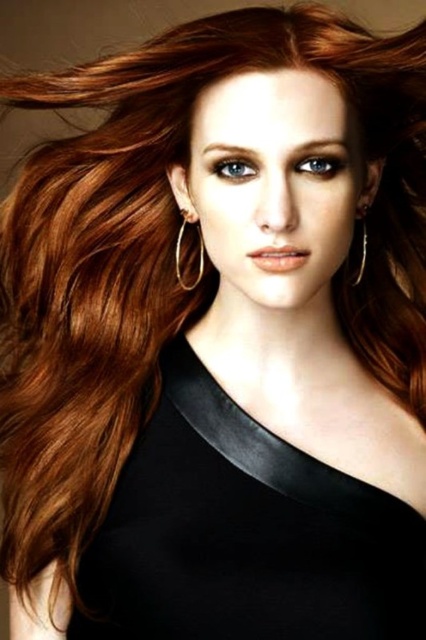
Question: Which object is closer to the camera taking this photo?

Choices:
 (A) black satin dress at center
 (B) silver metallic hoop at center
 (C) gold metallic hoop at upper left

Answer: (A)

Question: Does silver metallic hoop at center have a smaller size compared to gold metallic hoop at upper left?

Choices:
 (A) no
 (B) yes

Answer: (A)

Question: Does silver metallic hoop at center appear over gold metallic hoop at upper left?

Choices:
 (A) yes
 (B) no

Answer: (A)

Question: Estimate the real-world distances between objects in this image. Which object is farther from the black satin dress at center?

Choices:
 (A) silver metallic hoop at center
 (B) gold metallic hoop at upper left

Answer: (B)

Question: Is black satin dress at center positioned before gold metallic hoop at upper left?

Choices:
 (A) no
 (B) yes

Answer: (B)

Question: Which object is positioned closest to the gold metallic hoop at upper left?

Choices:
 (A) black satin dress at center
 (B) silver metallic hoop at center

Answer: (B)